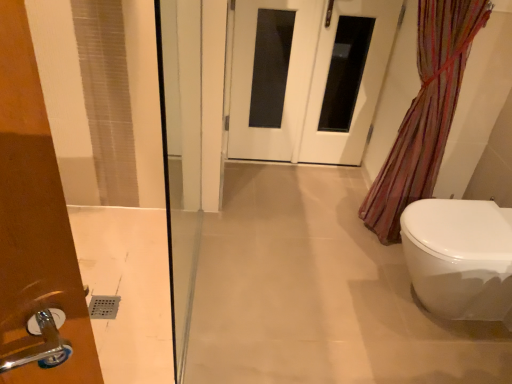
I want to click on vacant space in front of white glossy door at center, so click(291, 200).